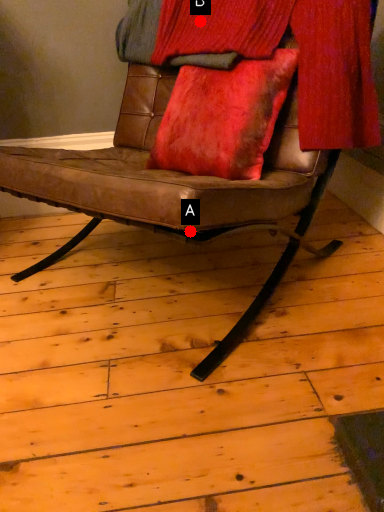
Question: Two points are circled on the image, labeled by A and B beside each circle. Which point appears closest to the camera in this image?

Choices:
 (A) A is closer
 (B) B is closer

Answer: (A)